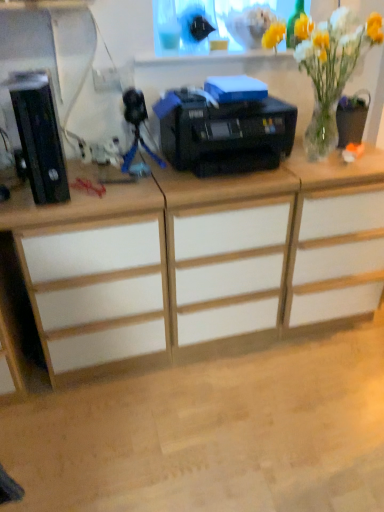
Question: From a real-world perspective, is translucent glass vase at upper right positioned under blue plastic tripod at center based on gravity?

Choices:
 (A) no
 (B) yes

Answer: (A)

Question: Is translucent glass vase at upper right taller than blue plastic tripod at center?

Choices:
 (A) no
 (B) yes

Answer: (B)

Question: Can you confirm if translucent glass vase at upper right is thinner than blue plastic tripod at center?

Choices:
 (A) yes
 (B) no

Answer: (B)

Question: Is translucent glass vase at upper right smaller than blue plastic tripod at center?

Choices:
 (A) no
 (B) yes

Answer: (A)

Question: Is translucent glass vase at upper right at the left side of blue plastic tripod at center?

Choices:
 (A) yes
 (B) no

Answer: (B)

Question: From a real-world perspective, is black plastic computer tower at left positioned above or below white matte drawer at center?

Choices:
 (A) above
 (B) below

Answer: (A)

Question: Looking at the image, does black plastic computer tower at left seem bigger or smaller compared to white matte drawer at center?

Choices:
 (A) small
 (B) big

Answer: (A)

Question: Relative to white matte drawer at center, is black plastic computer tower at left in front or behind?

Choices:
 (A) behind
 (B) front

Answer: (B)

Question: In the image, is black plastic computer tower at left on the left side or the right side of white matte drawer at center?

Choices:
 (A) left
 (B) right

Answer: (A)

Question: In terms of width, does white matte drawer at center look wider or thinner when compared to translucent glass vase at upper right?

Choices:
 (A) wide
 (B) thin

Answer: (A)

Question: In terms of height, does white matte drawer at center look taller or shorter compared to translucent glass vase at upper right?

Choices:
 (A) short
 (B) tall

Answer: (B)

Question: Considering the relative positions of white matte drawer at center and translucent glass vase at upper right in the image provided, is white matte drawer at center to the left or to the right of translucent glass vase at upper right?

Choices:
 (A) right
 (B) left

Answer: (B)

Question: Do you think white matte drawer at center is within translucent glass vase at upper right, or outside of it?

Choices:
 (A) inside
 (B) outside

Answer: (B)

Question: Is white matte desk at left situated inside blue plastic tripod at center or outside?

Choices:
 (A) outside
 (B) inside

Answer: (A)

Question: Considering the positions of point (145, 309) and point (125, 155), is point (145, 309) closer or farther from the camera than point (125, 155)?

Choices:
 (A) farther
 (B) closer

Answer: (B)